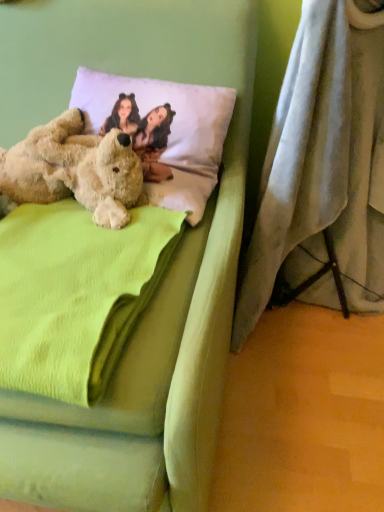
The image size is (384, 512). I want to click on free space above white soft pillow at upper center (from a real-world perspective), so click(x=130, y=80).